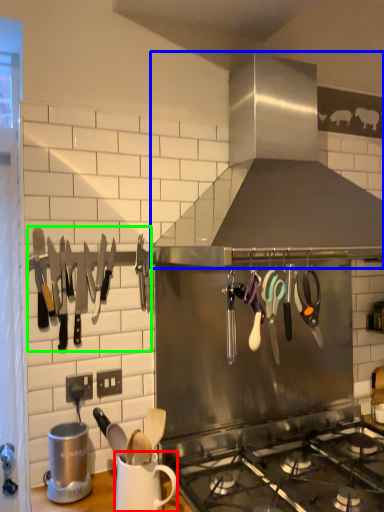
Question: Estimate the real-world distances between objects in this image. Which object is closer to mug (highlighted by a red box), kitchen appliance (highlighted by a blue box) or cutlery (highlighted by a green box)?

Choices:
 (A) kitchen appliance
 (B) cutlery

Answer: (B)